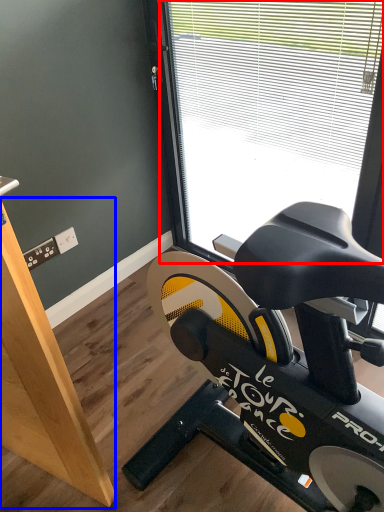
Question: Which object is closer to the camera taking this photo, window (highlighted by a red box) or plywood (highlighted by a blue box)?

Choices:
 (A) window
 (B) plywood

Answer: (B)